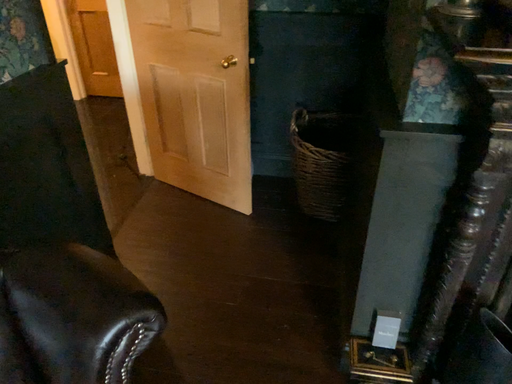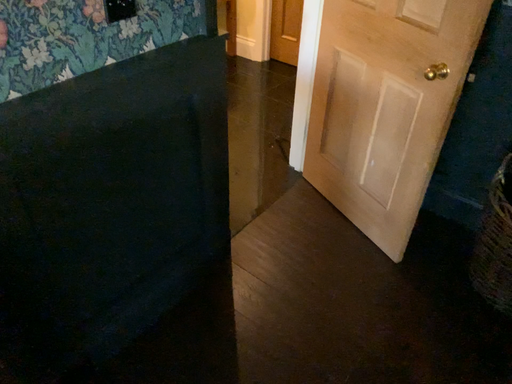
Question: Which way did the camera rotate in the video?

Choices:
 (A) rotated left
 (B) rotated right

Answer: (A)